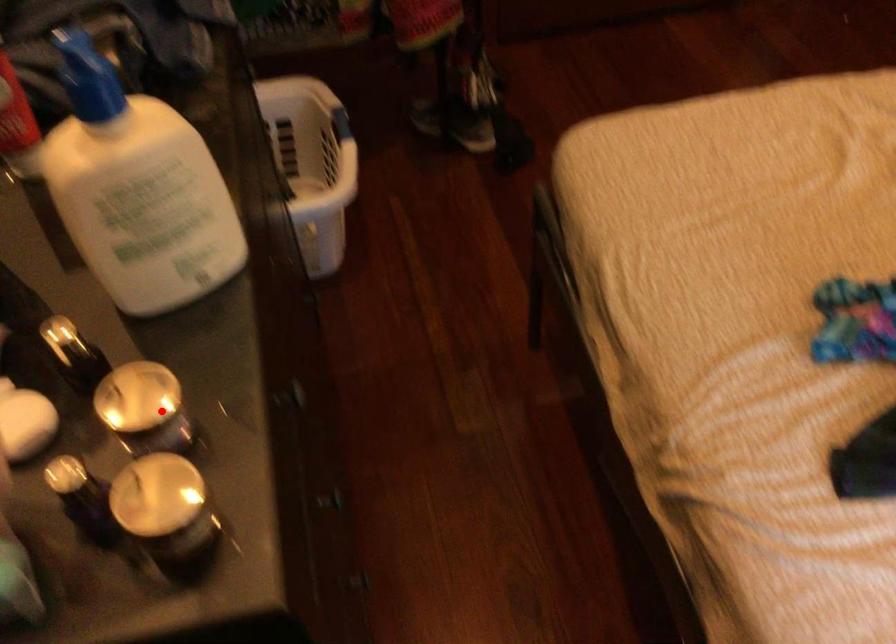
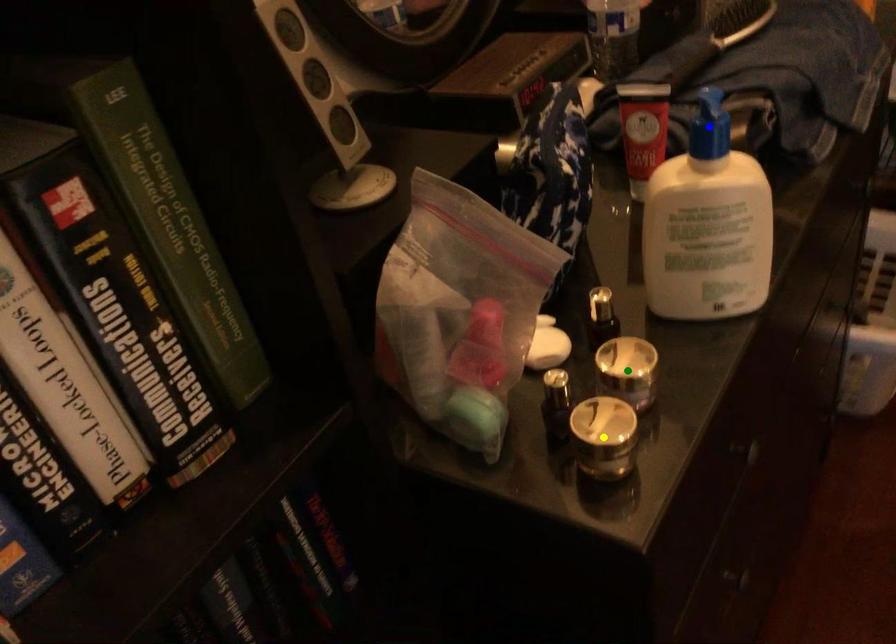
Question: I am providing you with two images of the same scene from different viewpoints. A red point is marked on the first image. You are given multiple points on the second image. Which point in image 2 is actually the same real-world point as the red point in image 1?

Choices:
 (A) green point
 (B) blue point
 (C) yellow point

Answer: (A)